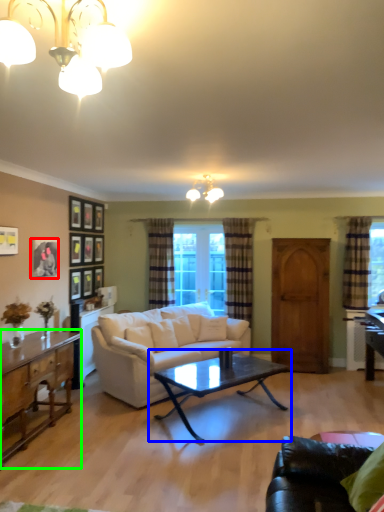
Question: Which object is positioned closest to picture frame (highlighted by a red box)? Select from coffee table (highlighted by a blue box) and cabinetry (highlighted by a green box).

Choices:
 (A) coffee table
 (B) cabinetry

Answer: (B)